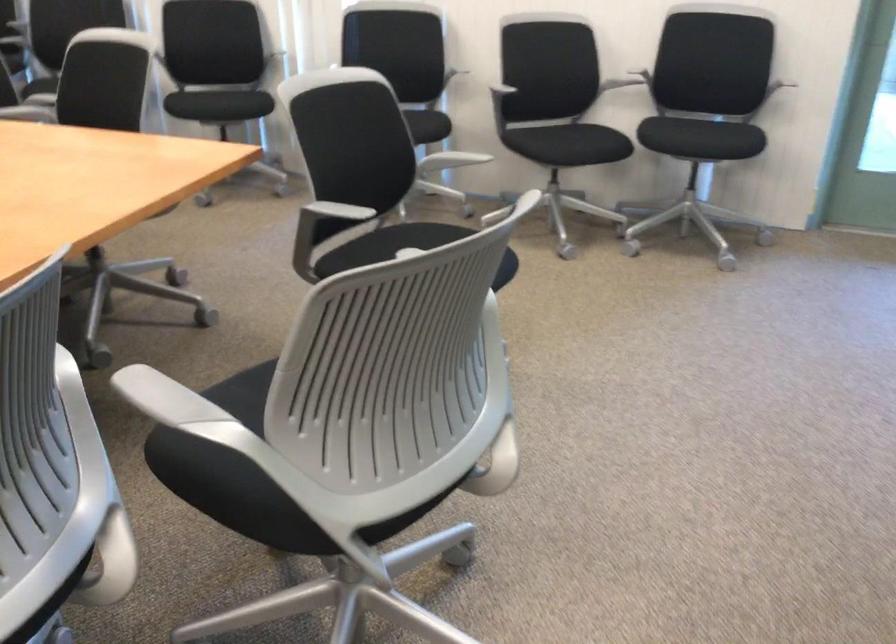
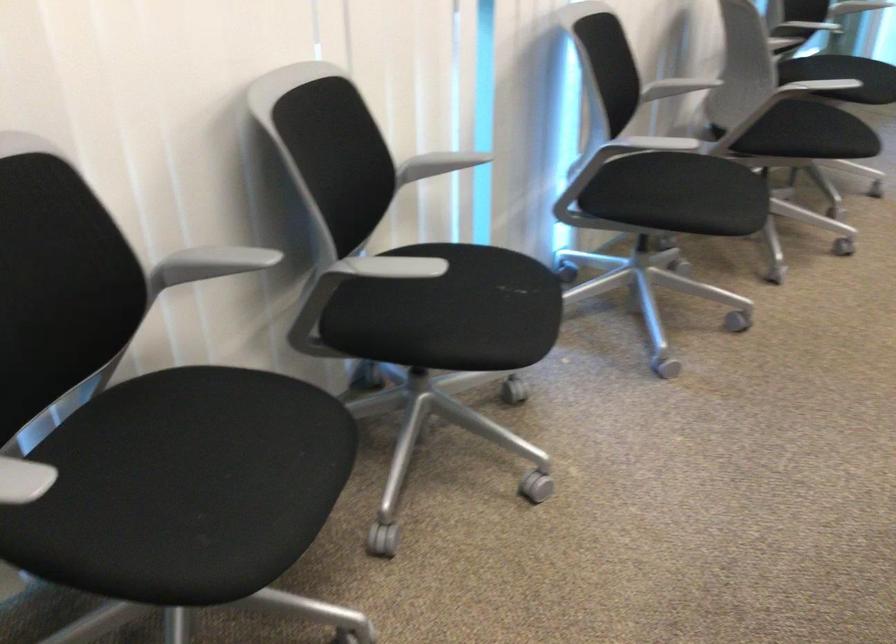
Where in the second image is the point corresponding to point 229,98 from the first image?

(515, 287)